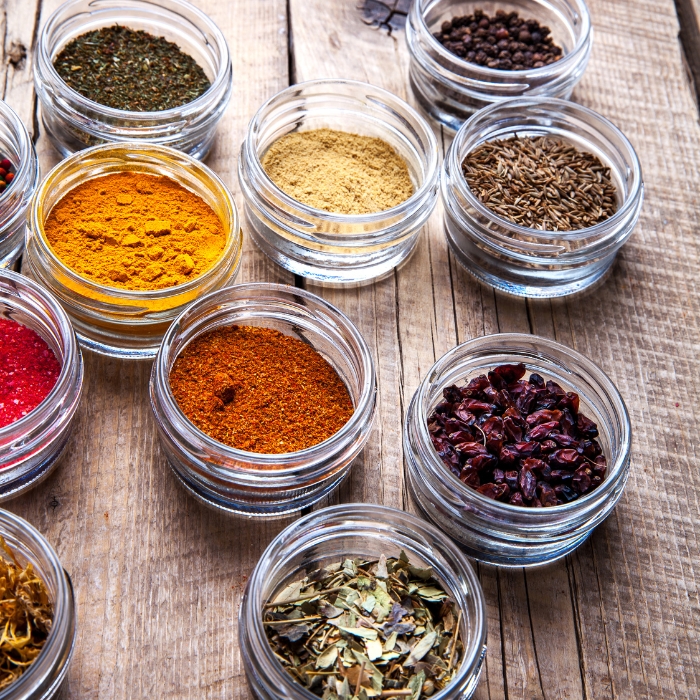
This screenshot has height=700, width=700. I want to click on grey wooden table, so click(x=147, y=586).